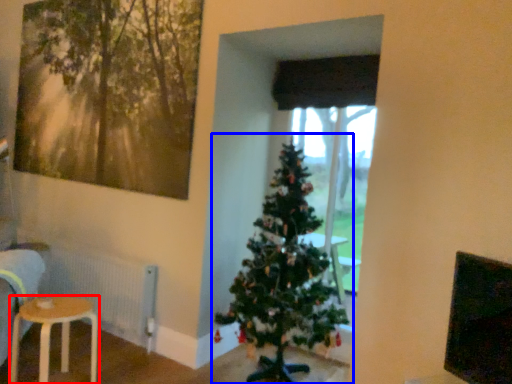
Question: Which point is further to the camera, stool (highlighted by a red box) or christmas tree (highlighted by a blue box)?

Choices:
 (A) stool
 (B) christmas tree

Answer: (A)